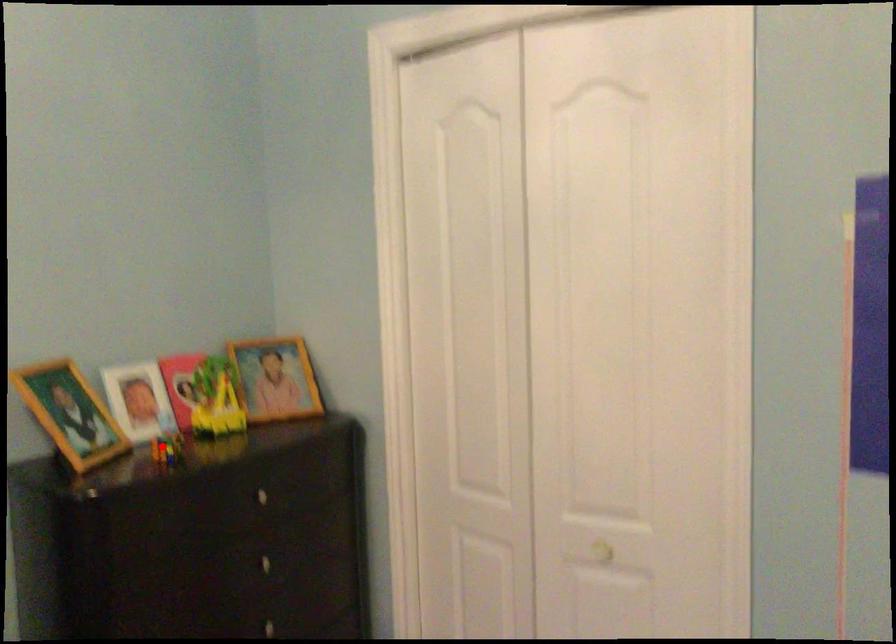
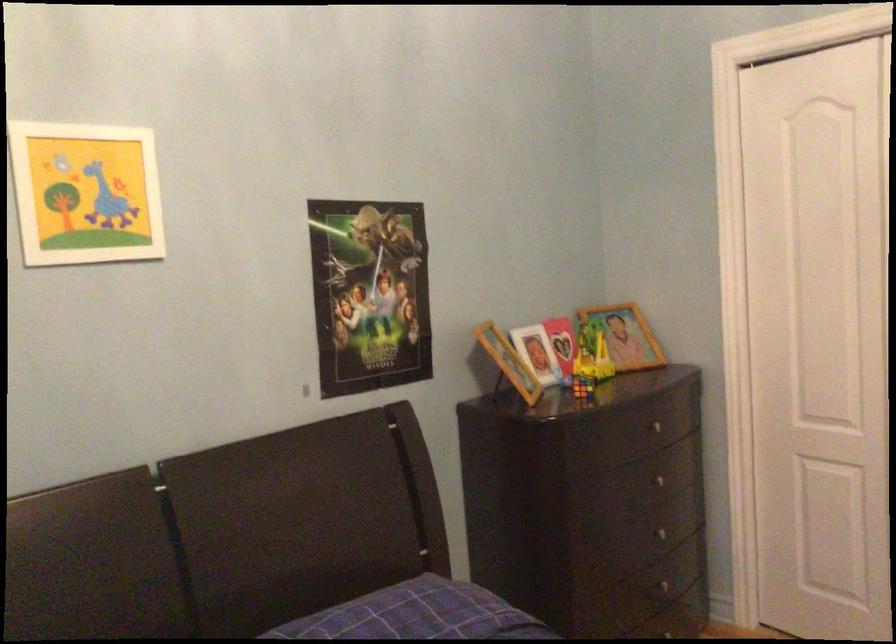
Question: I am providing you with two images of the same scene from different viewpoints. A red point is marked on the first image. Is the red point's position out of view in image 2?

Choices:
 (A) Yes
 (B) No

Answer: (B)